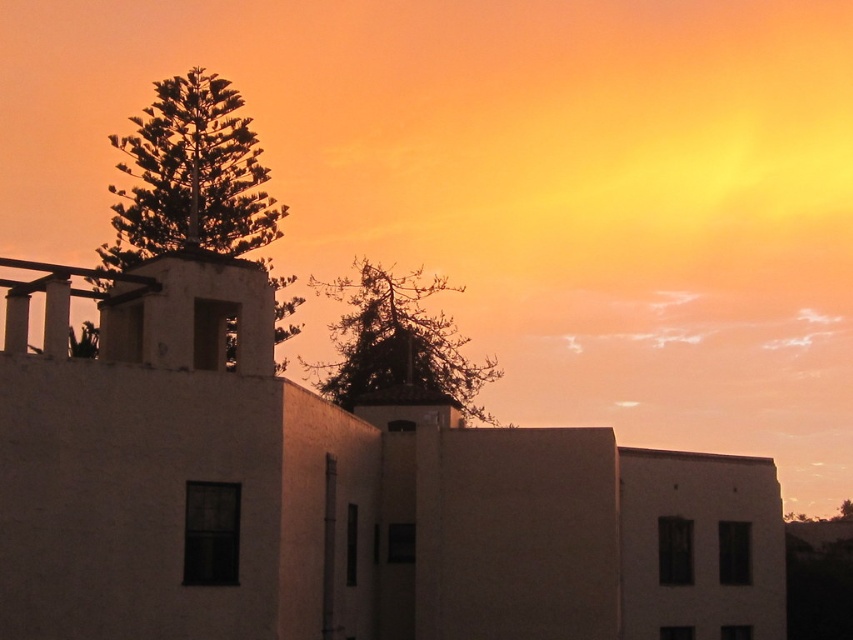
Question: Observing the image, what is the correct spatial positioning of green leafy tree at upper left in reference to silvery metallic tree at upper center?

Choices:
 (A) right
 (B) left

Answer: (B)

Question: Among these objects, which one is farthest from the camera?

Choices:
 (A) silvery metallic tree at upper center
 (B) green leafy tree at upper left

Answer: (A)

Question: Which of the following is the closest to the observer?

Choices:
 (A) silvery metallic tree at upper center
 (B) green leafy tree at upper left

Answer: (B)

Question: Is green leafy tree at upper left to the left of silvery metallic tree at upper center from the viewer's perspective?

Choices:
 (A) no
 (B) yes

Answer: (B)

Question: Which point is farther to the camera?

Choices:
 (A) tap(135, 225)
 (B) tap(390, 385)

Answer: (B)

Question: From the image, what is the correct spatial relationship of green leafy tree at upper left in relation to silvery metallic tree at upper center?

Choices:
 (A) left
 (B) right

Answer: (A)